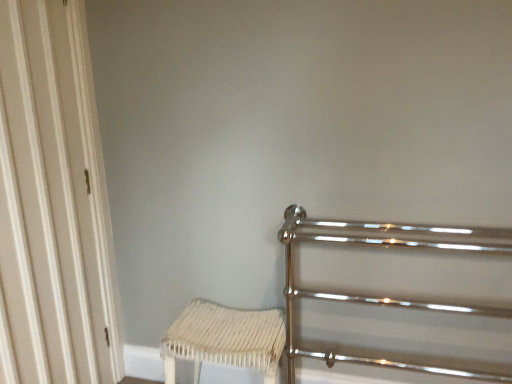
Question: Looking at the image, does white wood door at left seem bigger or smaller compared to white woven stool at lower center?

Choices:
 (A) small
 (B) big

Answer: (B)

Question: Is point (x=74, y=264) positioned closer to the camera than point (x=272, y=367)?

Choices:
 (A) closer
 (B) farther

Answer: (B)

Question: Which object is positioned farthest from the polished chrome rail at right?

Choices:
 (A) white wood door at left
 (B) white woven stool at lower center

Answer: (A)

Question: Estimate the real-world distances between objects in this image. Which object is closer to the white woven stool at lower center?

Choices:
 (A) polished chrome rail at right
 (B) white wood door at left

Answer: (A)